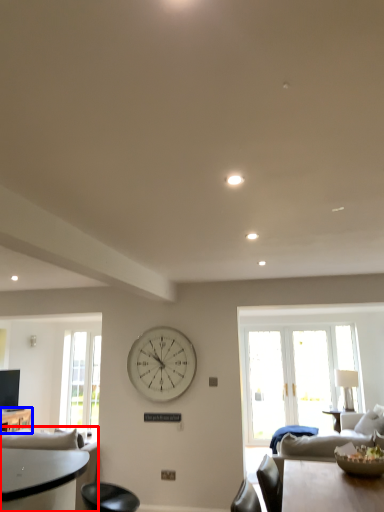
Question: Which point is further to the camera, studio couch (highlighted by a red box) or table (highlighted by a blue box)?

Choices:
 (A) studio couch
 (B) table

Answer: (B)